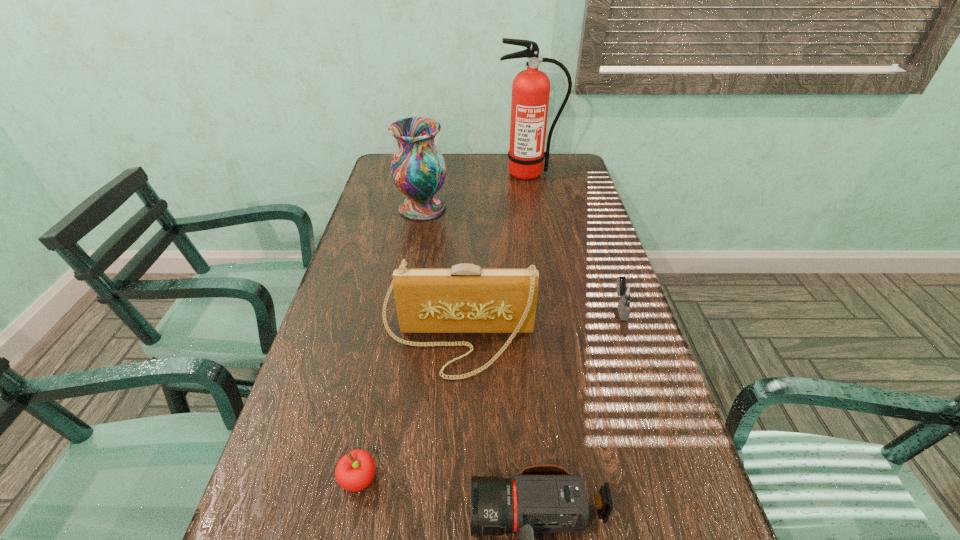
Find the location of a particular element. the farthest object is located at coordinates (531, 88).

At what (x,y) coordinates should I click in order to perform the action: click on the tallest object. Please return your answer as a coordinate pair (x, y). Looking at the image, I should click on (531, 88).

Find the location of a particular element. This screenshot has height=540, width=960. the second tallest object is located at coordinates (418, 169).

This screenshot has height=540, width=960. What are the coordinates of `vase` in the screenshot? It's located at (418, 169).

At what (x,y) coordinates should I click in order to perform the action: click on the third tallest object. Please return your answer as a coordinate pair (x, y). The width and height of the screenshot is (960, 540). Looking at the image, I should click on (465, 298).

At what (x,y) coordinates should I click in order to perform the action: click on igniter. Please return your answer as a coordinate pair (x, y). The width and height of the screenshot is (960, 540). Looking at the image, I should click on (626, 292).

Where is `apple`? The height and width of the screenshot is (540, 960). apple is located at coordinates (355, 471).

The width and height of the screenshot is (960, 540). Identify the location of free region located 0.400m on the handle side of the fire extinguisher. [x=541, y=247].

I want to click on vacant space located 0.140m on the back of the fifth nearest object, so click(428, 176).

This screenshot has height=540, width=960. Identify the location of vacant space situated 0.250m on the decorative side of the handbag. (450, 497).